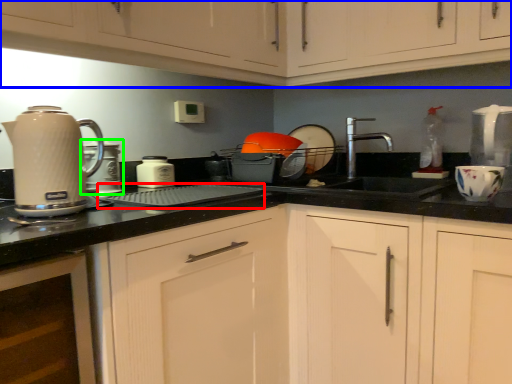
Question: Which is nearer to the appliance (highlighted by a red box)? cabinetry (highlighted by a blue box) or kitchen appliance (highlighted by a green box).

Choices:
 (A) cabinetry
 (B) kitchen appliance

Answer: (B)